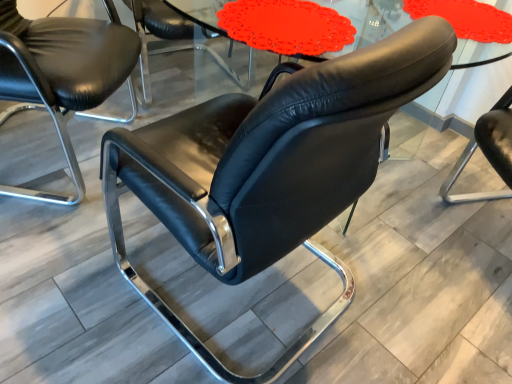
Question: Is the position of black leather chair at center, the 1th chair viewed from the front, more distant than that of black leather chair at center, the third chair in the front-to-back sequence?

Choices:
 (A) yes
 (B) no

Answer: (B)

Question: Can you confirm if black leather chair at center, arranged as the 3th chair when viewed from the back, is thinner than black leather chair at center, arranged as the 1th chair when viewed from the back?

Choices:
 (A) no
 (B) yes

Answer: (A)

Question: Can black leather chair at center, the third chair in the front-to-back sequence, be found inside black leather chair at center, the 1th chair viewed from the front?

Choices:
 (A) yes
 (B) no

Answer: (B)

Question: From the image's perspective, would you say black leather chair at center, arranged as the 3th chair when viewed from the back, is shown under black leather chair at center, the third chair in the front-to-back sequence?

Choices:
 (A) no
 (B) yes

Answer: (B)

Question: From a real-world perspective, is black leather chair at center, arranged as the 3th chair when viewed from the back, positioned over black leather chair at center, arranged as the 1th chair when viewed from the back, based on gravity?

Choices:
 (A) no
 (B) yes

Answer: (B)

Question: Would you say black leather chair at center, the 1th chair viewed from the front, is outside black leather chair at center, the third chair in the front-to-back sequence?

Choices:
 (A) no
 (B) yes

Answer: (B)

Question: From the image's perspective, is matte glass table at center below black leather chair at left, arranged as the second chair when viewed from the back?

Choices:
 (A) no
 (B) yes

Answer: (A)

Question: Considering the relative sizes of matte glass table at center and black leather chair at left, arranged as the second chair when viewed from the front, in the image provided, is matte glass table at center shorter than black leather chair at left, arranged as the second chair when viewed from the front,?

Choices:
 (A) no
 (B) yes

Answer: (B)

Question: Considering the relative sizes of matte glass table at center and black leather chair at left, arranged as the second chair when viewed from the front, in the image provided, is matte glass table at center bigger than black leather chair at left, arranged as the second chair when viewed from the front,?

Choices:
 (A) yes
 (B) no

Answer: (B)

Question: Is matte glass table at center aimed at black leather chair at left, arranged as the second chair when viewed from the front?

Choices:
 (A) no
 (B) yes

Answer: (A)

Question: Is matte glass table at center positioned far away from black leather chair at left, arranged as the second chair when viewed from the front?

Choices:
 (A) yes
 (B) no

Answer: (B)

Question: From a real-world perspective, is matte glass table at center under black leather chair at left, arranged as the second chair when viewed from the back?

Choices:
 (A) no
 (B) yes

Answer: (A)

Question: From the image's perspective, would you say black leather chair at left, arranged as the second chair when viewed from the front, is shown under matte glass table at center?

Choices:
 (A) yes
 (B) no

Answer: (A)